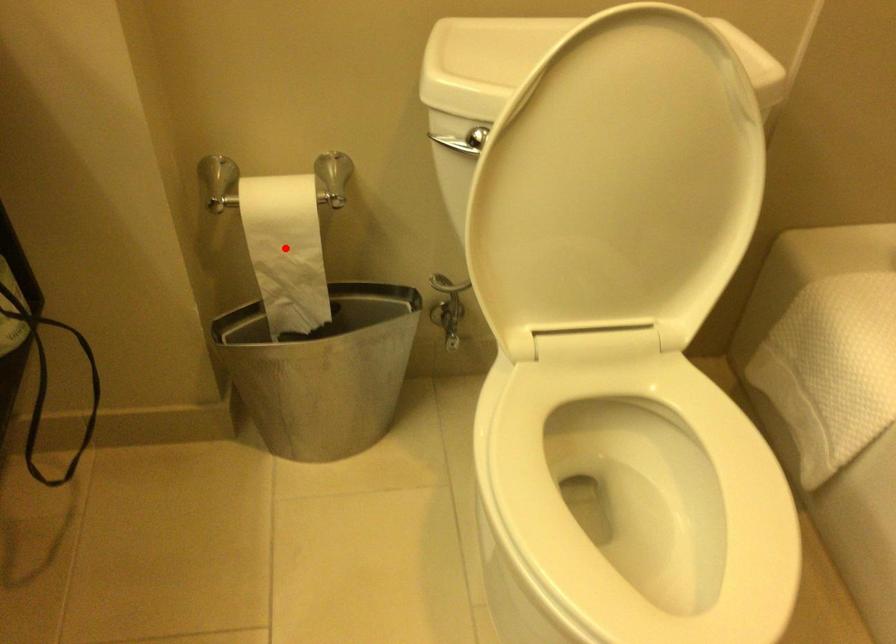
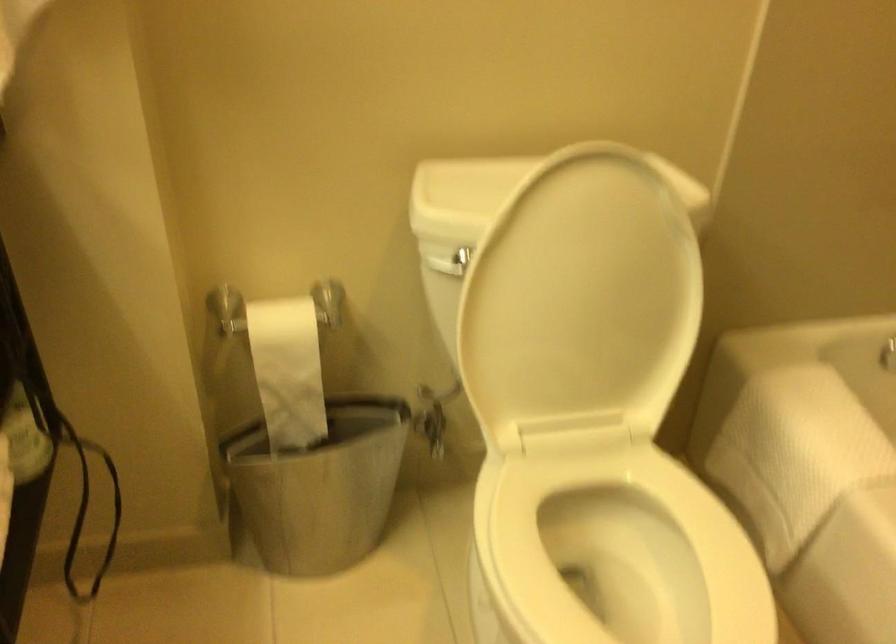
Locate, in the second image, the point that corresponds to the highlighted location in the first image.

(288, 370)